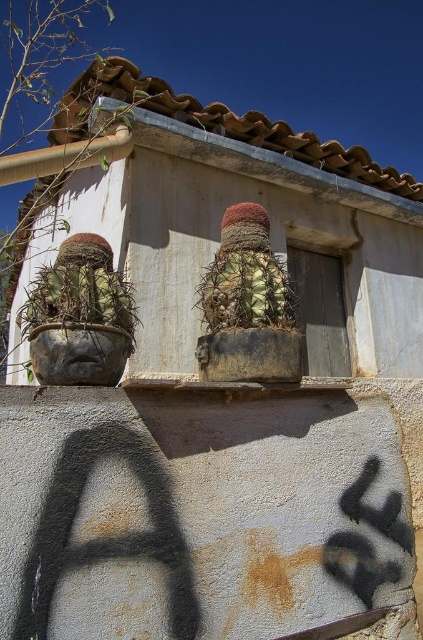
You are a visitor standing in front of the rustic building. You notice the rusty metal cactus at left and the green textured cactus at center. Which cactus is positioned lower on the wall?

The rusty metal cactus at left is positioned below the green textured cactus at center, so it is lower on the wall.

You are standing at the entrance of the rustic building and see the point marked at coordinates (79, 316). What object is located at that point?

The rusty metal cactus at left is located at point (79, 316).

You are a gardener who needs to water both the rusty metal cactus at left and the green textured cactus at center. If your watering can has a maximum reach of 20 inches, can you water both plants without moving the can?

The distance between the rusty metal cactus at left and the green textured cactus at center is 21.50 inches. Since the watering can only reaches 20 inches, you cannot water both plants without moving the can.